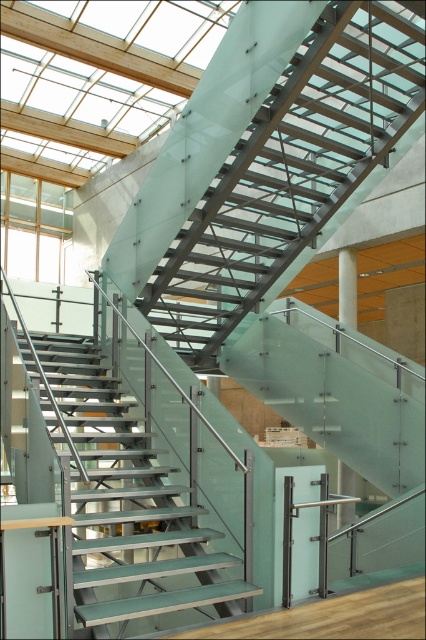
Question: Is green glass stairs at center thinner than white glossy pillar at center?

Choices:
 (A) no
 (B) yes

Answer: (A)

Question: Can you confirm if green glass stairs at center is positioned to the left of white glossy pillar at center?

Choices:
 (A) no
 (B) yes

Answer: (B)

Question: Does green glass stairs at center appear on the left side of white glossy pillar at center?

Choices:
 (A) yes
 (B) no

Answer: (A)

Question: Which of the following is the farthest from the observer?

Choices:
 (A) green glass stairs at center
 (B) white glossy pillar at center

Answer: (B)

Question: Which point is closer to the camera taking this photo?

Choices:
 (A) (77, 509)
 (B) (345, 253)

Answer: (A)